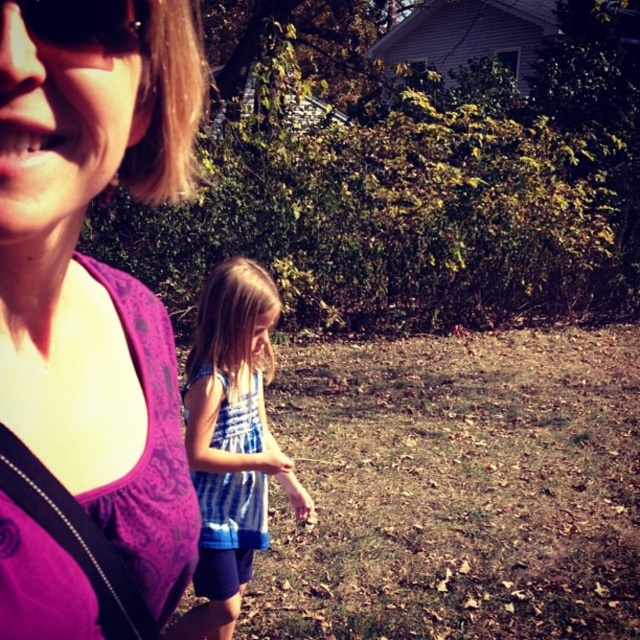
Question: Does purple fabric at upper left have a lesser width compared to blue striped dress at center?

Choices:
 (A) yes
 (B) no

Answer: (A)

Question: Based on their relative distances, which object is nearer to the purple fabric at upper left?

Choices:
 (A) blue striped dress at center
 (B) matte black sunglasses at upper left

Answer: (B)

Question: Estimate the real-world distances between objects in this image. Which object is closer to the matte black sunglasses at upper left?

Choices:
 (A) purple fabric at upper left
 (B) blue striped dress at center

Answer: (A)

Question: Is the position of purple fabric at upper left more distant than that of blue striped dress at center?

Choices:
 (A) no
 (B) yes

Answer: (A)

Question: Is purple fabric at upper left above blue striped dress at center?

Choices:
 (A) yes
 (B) no

Answer: (A)

Question: Which object is the closest to the matte black sunglasses at upper left?

Choices:
 (A) blue striped dress at center
 (B) purple fabric at upper left

Answer: (B)